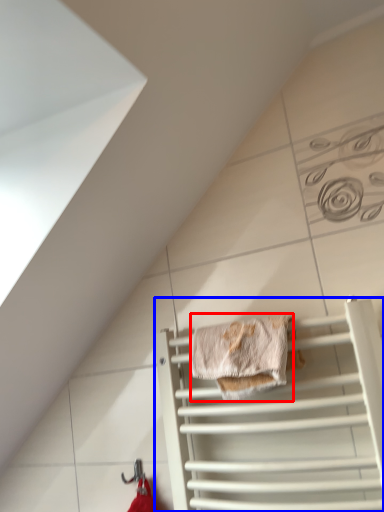
Question: Among these objects, which one is farthest to the camera, material (highlighted by a red box) or cage (highlighted by a blue box)?

Choices:
 (A) material
 (B) cage

Answer: (A)